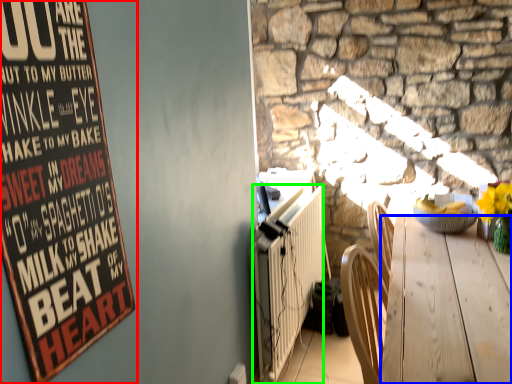
Question: Which is farther away from poster (highlighted by a red box)? desk (highlighted by a blue box) or radiator (highlighted by a green box)?

Choices:
 (A) desk
 (B) radiator

Answer: (B)